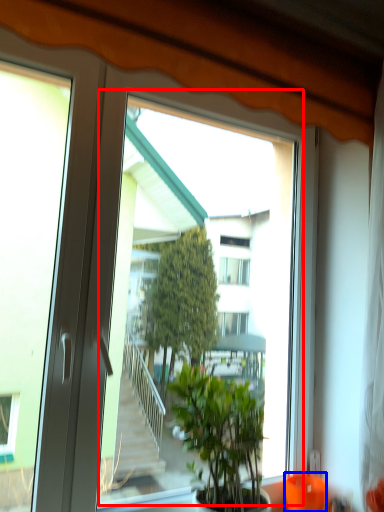
Question: Which object appears closest to the camera in this image, window screen (highlighted by a red box) or glass vase (highlighted by a blue box)?

Choices:
 (A) window screen
 (B) glass vase

Answer: (A)